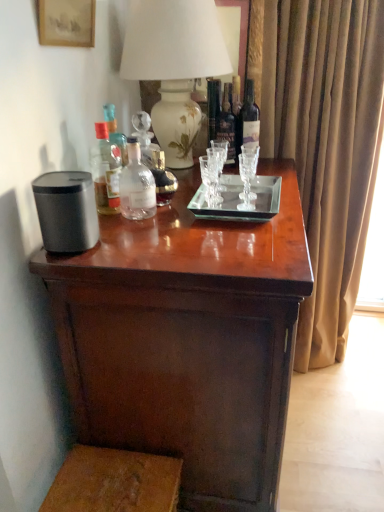
Where is `free point to the right of dark glass bottle at upper right, which is counted as the 1th bottle, starting from the right`? free point to the right of dark glass bottle at upper right, which is counted as the 1th bottle, starting from the right is located at coordinates (275, 168).